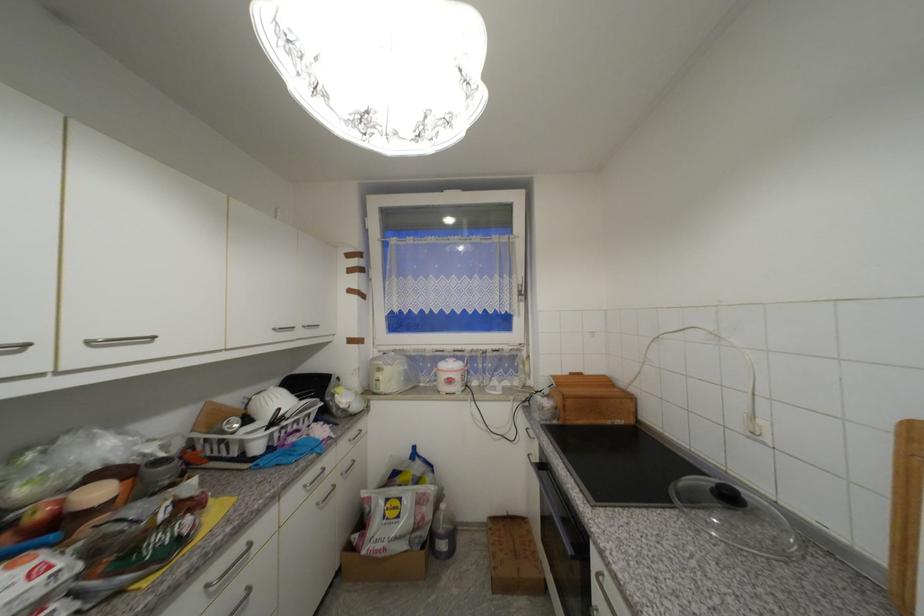
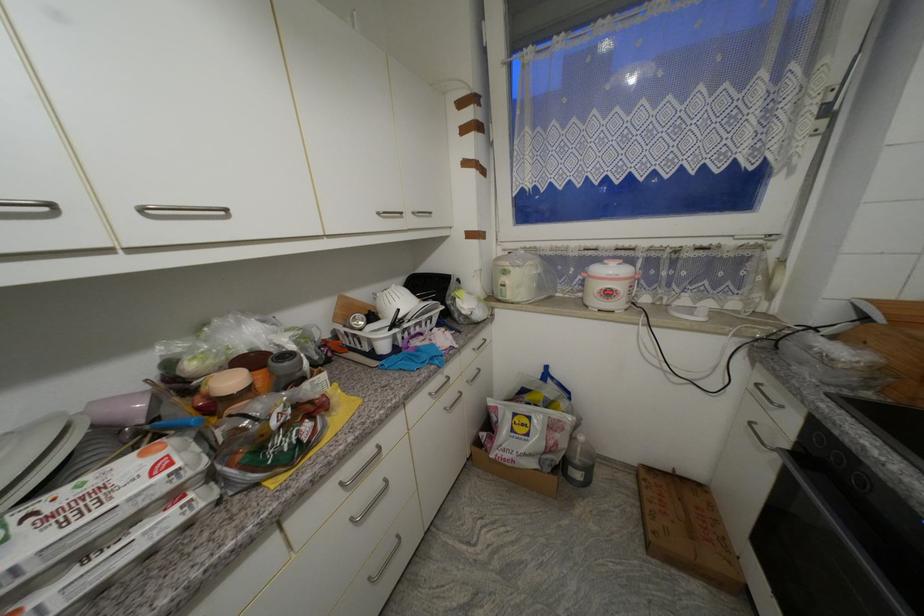
The first image is from the beginning of the video and the second image is from the end. How did the camera likely rotate when shooting the video?

The rotation direction of the camera is left-down.